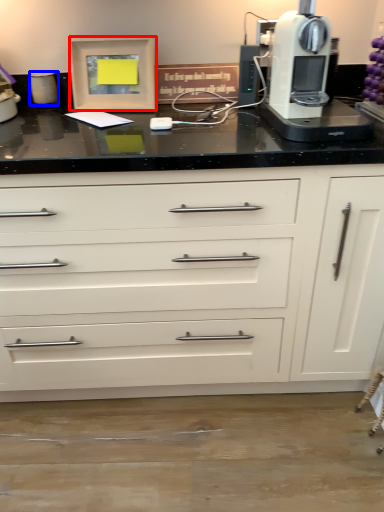
Question: Which object appears farthest to the camera in this image, picture frame (highlighted by a red box) or kitchen appliance (highlighted by a blue box)?

Choices:
 (A) picture frame
 (B) kitchen appliance

Answer: (B)